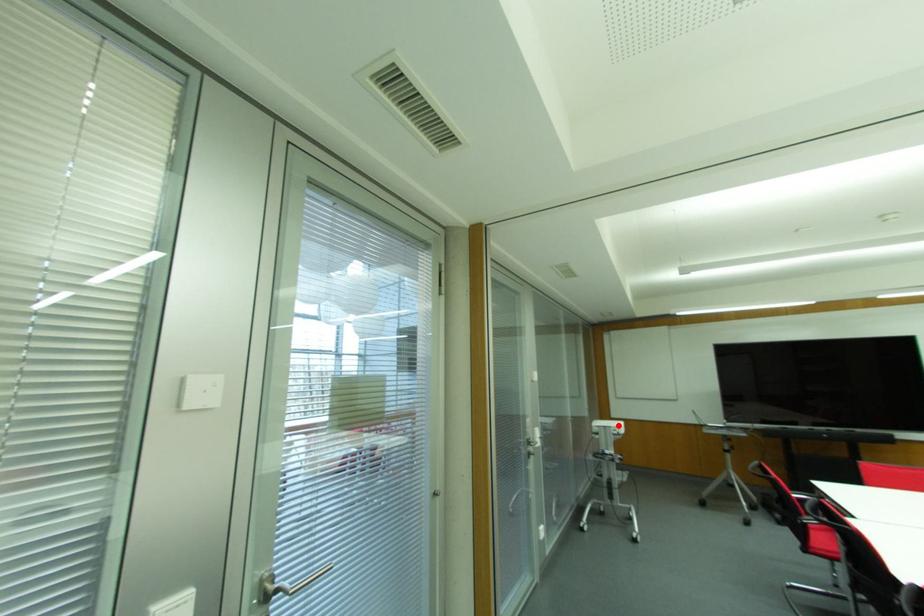
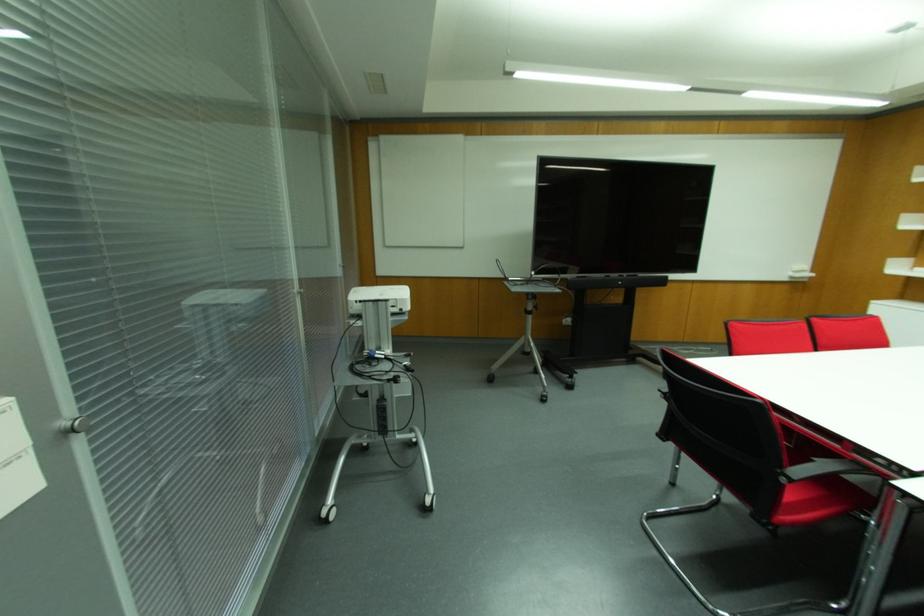
The point at the highlighted location is marked in the first image. Where is the corresponding point in the second image?

(399, 294)